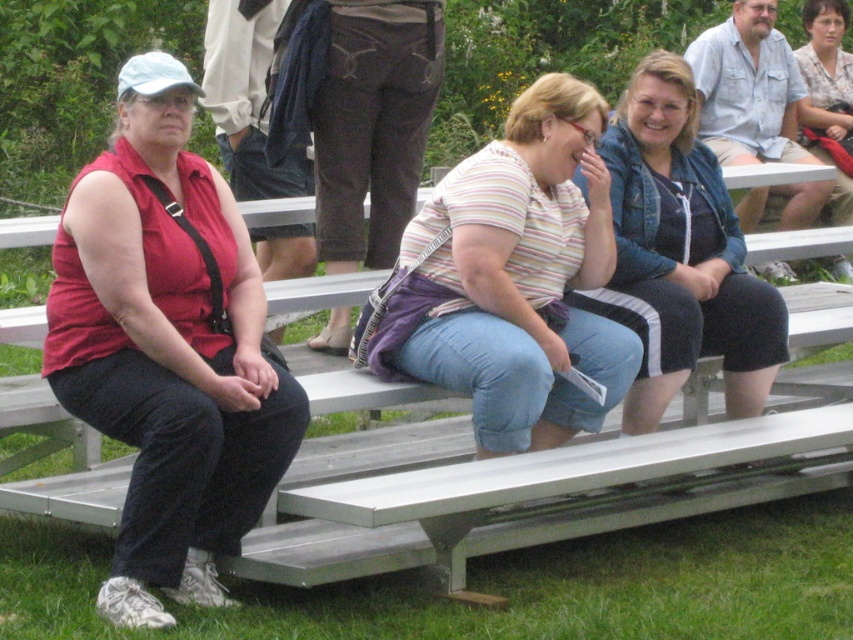
From the picture: You are standing in front of the bleachers and want to place a small flag at the point closer to you between point (753, 234) and point (734, 291). Which point should you choose?

You should choose point (734, 291) because it is closer to you than point (753, 234).

Based on the coordinates provided, where is the metallic silver bench at center located in the image?

The metallic silver bench at center is located at the coordinates point (485, 490).

You are standing at the entrance of the bleachers and want to hand a flyer to both the matte red shirt at left and the denim jacket at center. If you can throw the flyer 1.6 meters, will you be able to reach both of them?

The matte red shirt at left is 1.71 meters away from the denim jacket at center. Since the distance between them is greater than your throwing range of 1.6 meters, you cannot reach both with a single throw. However, you can choose to throw to either one individually if they are within 1.6 meters from your position.